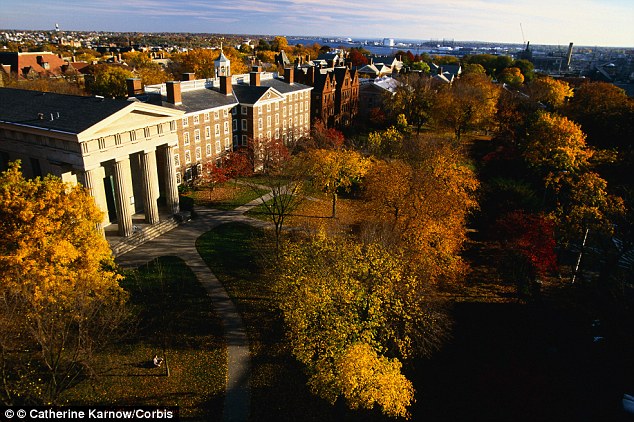
Image resolution: width=634 pixels, height=422 pixels. In order to click on pillar in this screenshot , I will do `click(120, 187)`, `click(153, 188)`, `click(172, 178)`.